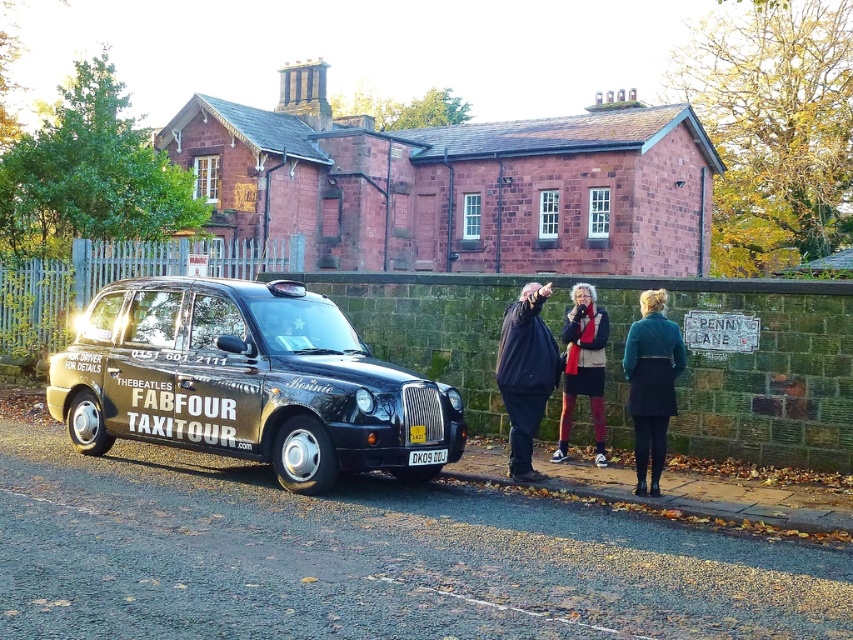
Question: Does black metallic taxi at lower left appear over black plastic license plate at center?

Choices:
 (A) no
 (B) yes

Answer: (B)

Question: Among these objects, which one is farthest from the camera?

Choices:
 (A) teal wool coat at lower right
 (B) black metallic taxi at lower left

Answer: (A)

Question: Can you confirm if teal wool coat at lower right is wider than velvet red scarf at center?

Choices:
 (A) no
 (B) yes

Answer: (A)

Question: From the image, what is the correct spatial relationship of teal wool coat at lower right in relation to velvet red scarf at center?

Choices:
 (A) right
 (B) left

Answer: (A)

Question: Which point is farther to the camera?

Choices:
 (A) teal wool coat at lower right
 (B) black plastic license plate at center
 (C) velvet red scarf at center

Answer: (C)

Question: Which object appears closest to the camera in this image?

Choices:
 (A) black metallic taxi at lower left
 (B) teal wool coat at lower right
 (C) black matte jacket at center

Answer: (A)